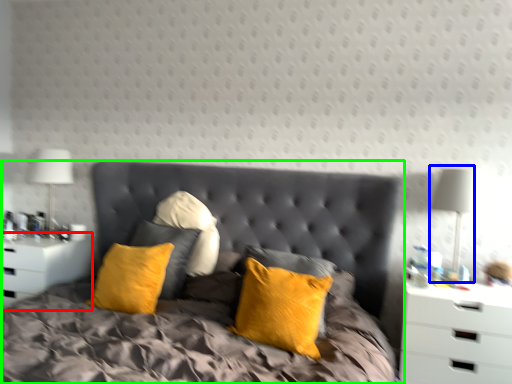
Question: Which is farther away from nightstand (highlighted by a red box)? bedside lamp (highlighted by a blue box) or bed (highlighted by a green box)?

Choices:
 (A) bedside lamp
 (B) bed

Answer: (A)